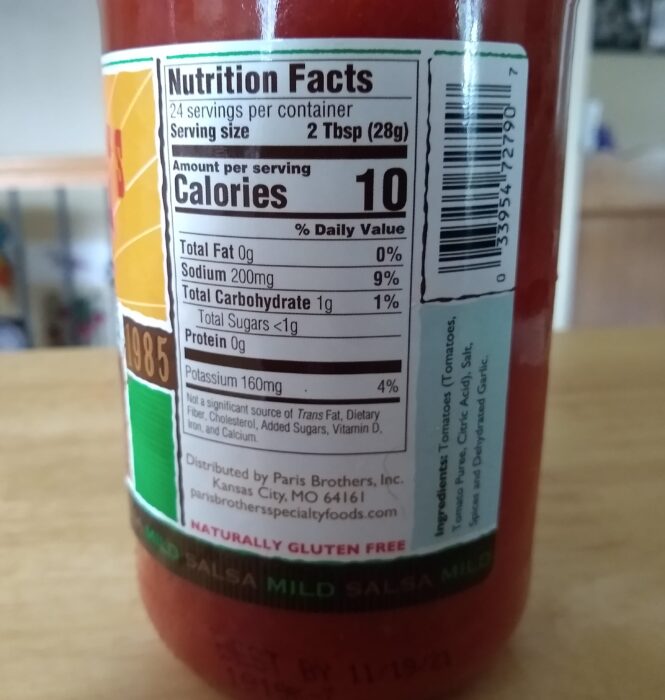
Locate an element on the screen. Image resolution: width=665 pixels, height=700 pixels. wooden table is located at coordinates (76, 575).